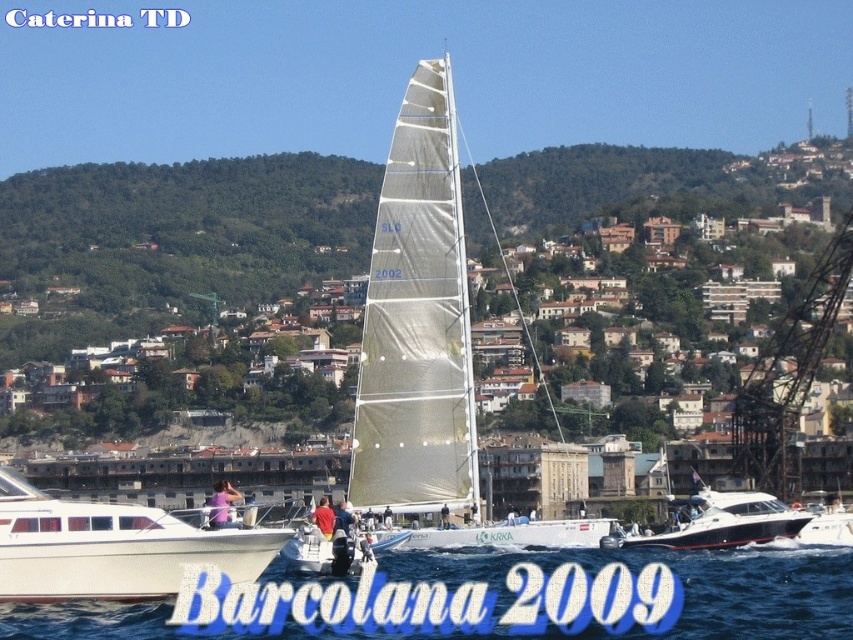
Does point (850, 577) come closer to viewer compared to point (787, 508)?

That is True.

Who is more forward, (x=167, y=614) or (x=712, y=500)?

Point (x=167, y=614) is in front.

Locate an element on the screen. The image size is (853, 640). blue water at lower center is located at coordinates (695, 586).

From the picture: Which is above, light brown leather jacket at center or white fabric sail at center?

white fabric sail at center is higher up.

What do you see at coordinates (444, 516) in the screenshot? I see `light brown leather jacket at center` at bounding box center [444, 516].

Is point (440, 513) positioned before point (386, 520)?

No.

You are a GUI agent. You are given a task and a screenshot of the screen. Output one action in this format:
    pyautogui.click(x=<x>, y=<y>)
    Task: Click on the light brown leather jacket at center
    This screenshot has height=640, width=853.
    Given the screenshot: What is the action you would take?
    pyautogui.click(x=444, y=516)

Is blue fabric shirt at center wider than white fabric sail at center?

Indeed, blue fabric shirt at center has a greater width compared to white fabric sail at center.

Who is higher up, blue fabric shirt at center or white fabric sail at center?

white fabric sail at center is higher up.

What do you see at coordinates (343, 516) in the screenshot?
I see `blue fabric shirt at center` at bounding box center [343, 516].

I want to click on blue fabric shirt at center, so click(x=343, y=516).